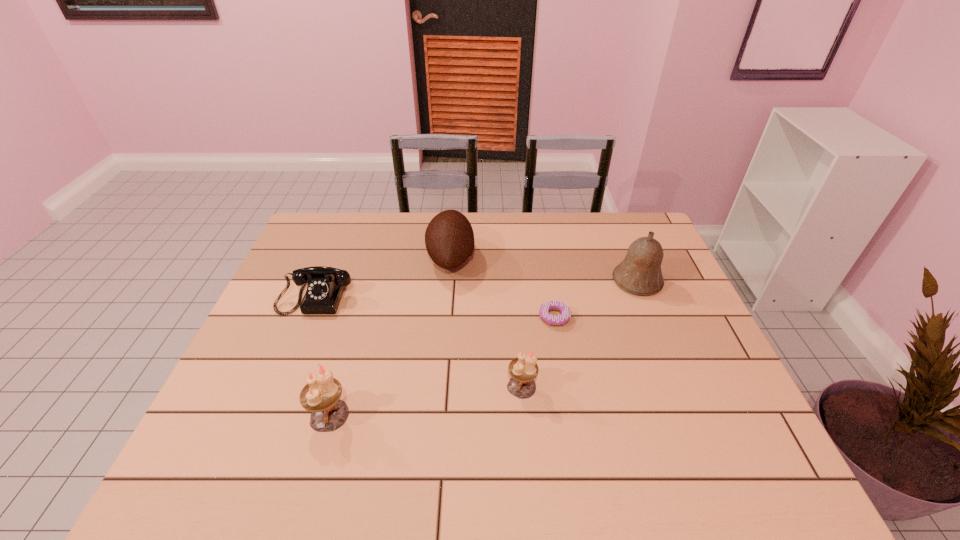
Where is `vacant region located on the laces of the third object from left to right`? The width and height of the screenshot is (960, 540). vacant region located on the laces of the third object from left to right is located at coordinates (566, 258).

Locate an element on the screen. The image size is (960, 540). free space located 0.160m on the dial of the telephone is located at coordinates (291, 361).

Locate an element on the screen. The width and height of the screenshot is (960, 540). vacant space located 0.340m on the left of the bell is located at coordinates (502, 281).

Where is `vacant region located on the back of the fifth object from left to right`? vacant region located on the back of the fifth object from left to right is located at coordinates (544, 259).

Find the location of a particular element. The width and height of the screenshot is (960, 540). object at the far edge is located at coordinates (449, 238).

Find the location of a particular element. The image size is (960, 540). object that is at the near edge is located at coordinates (321, 395).

Locate an element on the screen. object located in the left edge section of the desktop is located at coordinates (325, 286).

The width and height of the screenshot is (960, 540). What are the coordinates of `object present at the right edge` in the screenshot? It's located at (640, 273).

In the image, there is a desktop. Where is `vacant area at the far edge`? The height and width of the screenshot is (540, 960). vacant area at the far edge is located at coordinates (558, 219).

The image size is (960, 540). In order to click on vacant space at the near edge of the desktop in this screenshot , I will do `click(576, 407)`.